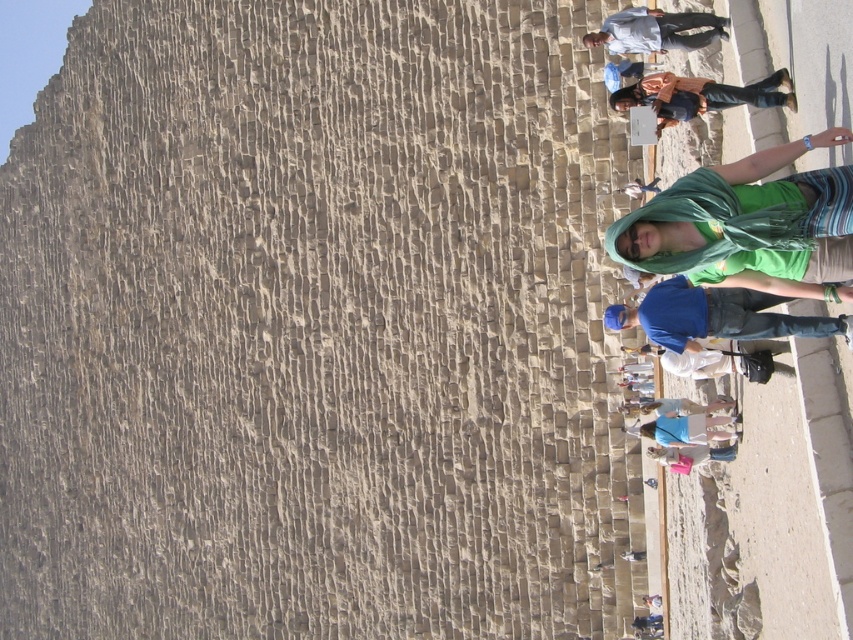
Question: Is orange fabric hoodie at upper right wider than light blue shirt at upper right?

Choices:
 (A) no
 (B) yes

Answer: (A)

Question: Does orange fabric hoodie at upper right have a larger size compared to light blue shirt at upper right?

Choices:
 (A) yes
 (B) no

Answer: (B)

Question: Which point appears farthest from the camera in this image?

Choices:
 (A) (664, 36)
 (B) (618, 90)

Answer: (B)

Question: Is orange fabric hoodie at upper right thinner than light blue shirt at upper right?

Choices:
 (A) no
 (B) yes

Answer: (B)

Question: Which point is closer to the camera taking this photo?

Choices:
 (A) click(793, 93)
 (B) click(711, 29)

Answer: (A)

Question: Which point appears farthest from the camera in this image?

Choices:
 (A) (654, 104)
 (B) (613, 52)

Answer: (B)